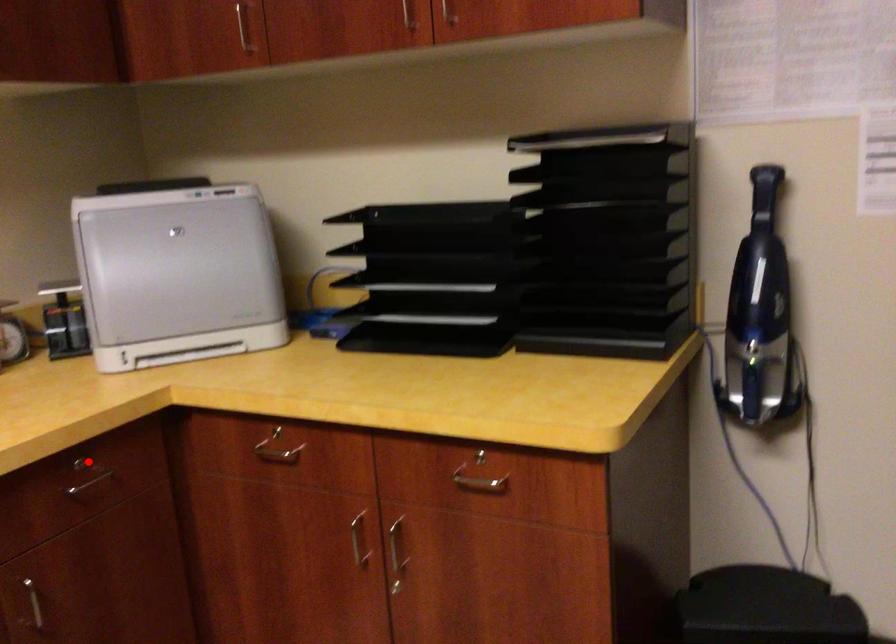
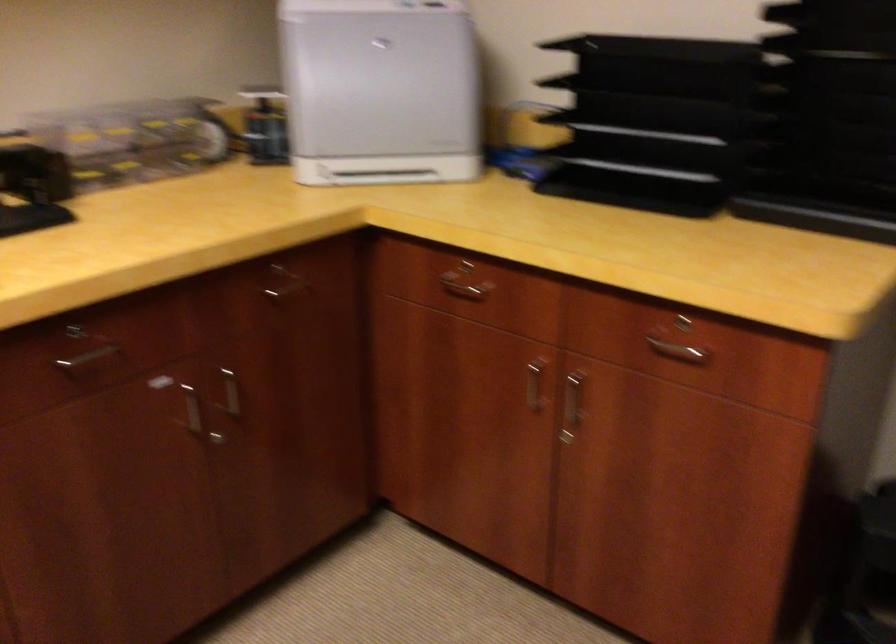
The point at the highlighted location is marked in the first image. Where is the corresponding point in the second image?

(282, 270)